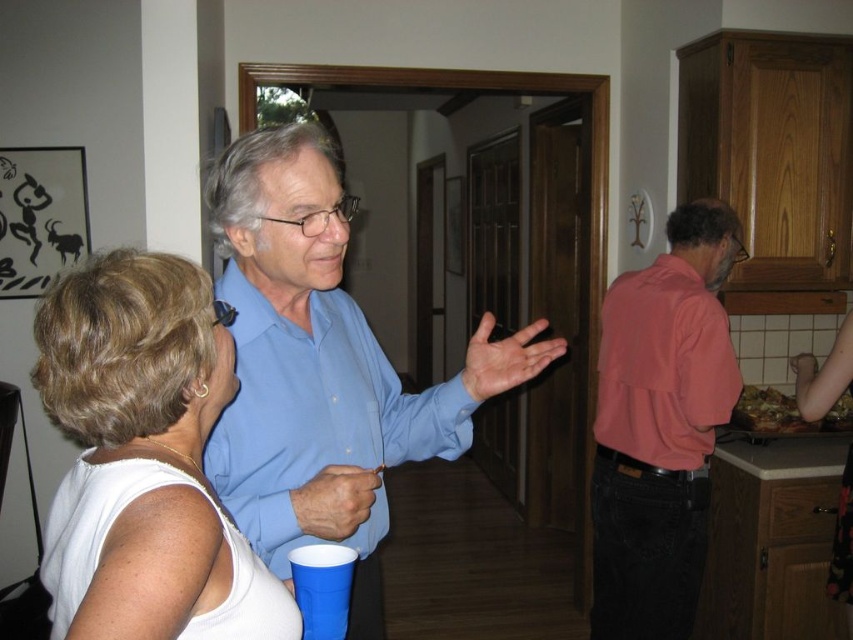
Question: From the image, what is the correct spatial relationship of white matte tank top at upper left in relation to pink cotton shirt at right?

Choices:
 (A) below
 (B) above

Answer: (B)

Question: Can you confirm if blue smooth shirt at center is positioned to the right of pink matte shirt at right?

Choices:
 (A) no
 (B) yes

Answer: (A)

Question: Among these points, which one is farthest from the camera?

Choices:
 (A) tap(595, 422)
 (B) tap(630, 636)
 (C) tap(256, 349)

Answer: (A)

Question: Which object is positioned farthest from the white matte tank top at upper left?

Choices:
 (A) matte blue shirt at center
 (B) pink matte shirt at right

Answer: (B)

Question: Which object is positioned closest to the blue plastic cup at lower center?

Choices:
 (A) pink matte shirt at right
 (B) blue smooth shirt at center
 (C) white matte tank top at upper left
 (D) pink cotton shirt at right

Answer: (B)

Question: Where is matte blue shirt at center located in relation to pink matte shirt at right in the image?

Choices:
 (A) left
 (B) right

Answer: (A)